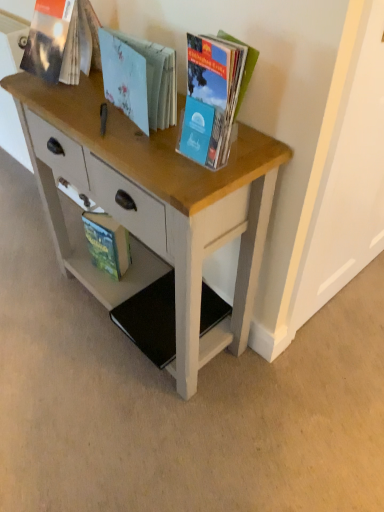
The height and width of the screenshot is (512, 384). In order to click on free region on the left part of matte plastic book at upper right, the first book in the front-to-back sequence in this screenshot , I will do `click(145, 152)`.